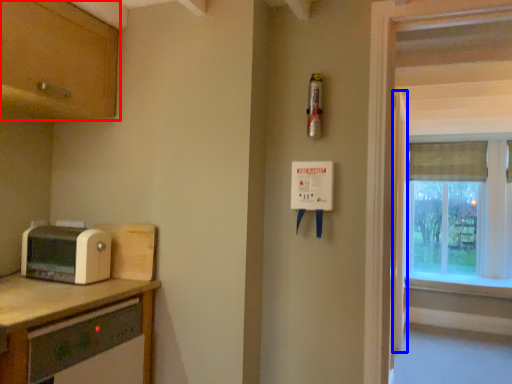
Question: Which object appears farthest to the camera in this image, cabinetry (highlighted by a red box) or screen door (highlighted by a blue box)?

Choices:
 (A) cabinetry
 (B) screen door

Answer: (B)